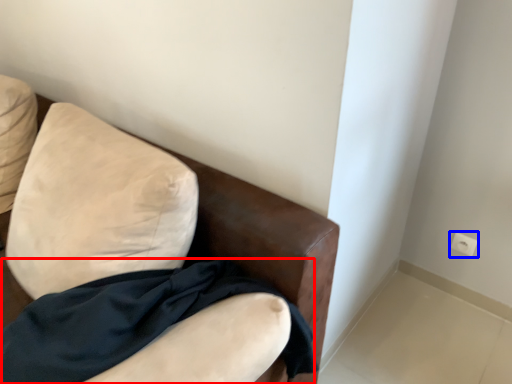
Question: Which point is closer to the camera, fabric (highlighted by a red box) or electric outlet (highlighted by a blue box)?

Choices:
 (A) fabric
 (B) electric outlet

Answer: (A)